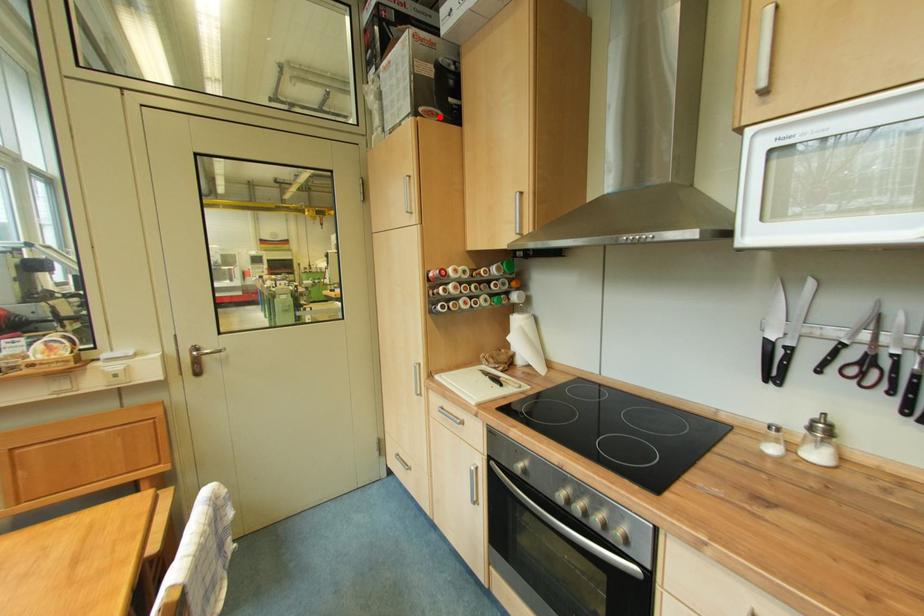
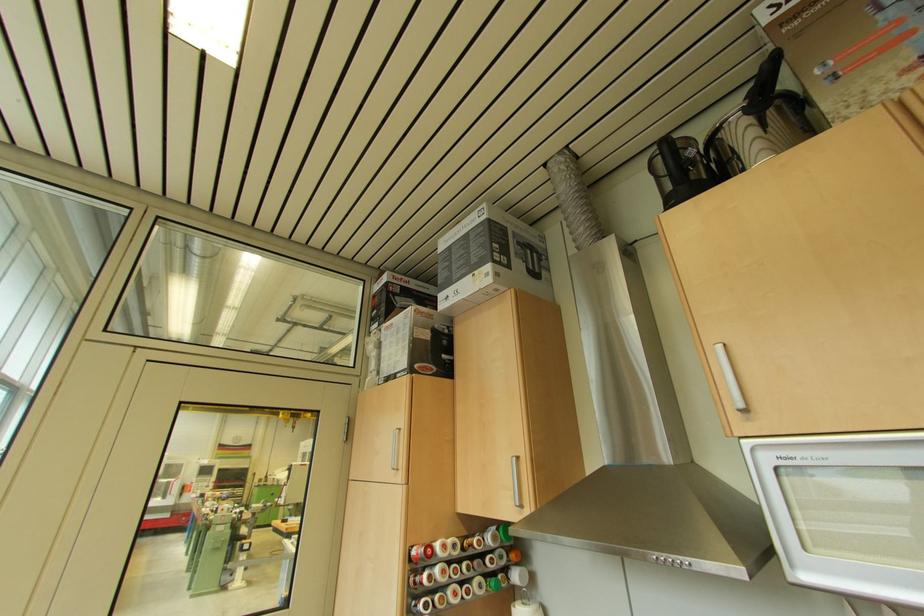
Locate, in the second image, the point that corresponds to the highlighted location in the first image.

(434, 371)